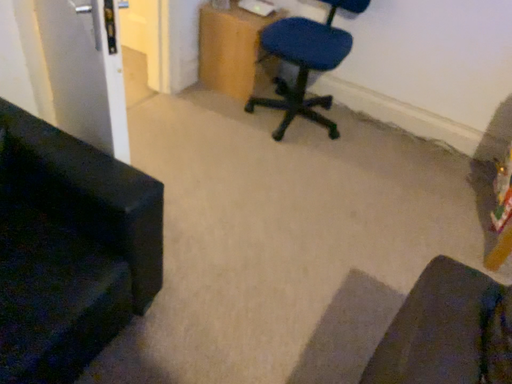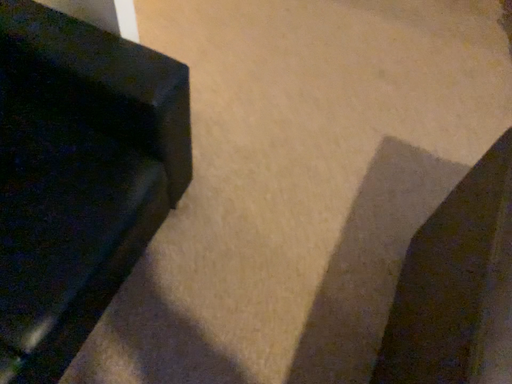
Question: How did the camera likely rotate when shooting the video?

Choices:
 (A) rotated upward
 (B) rotated downward

Answer: (B)